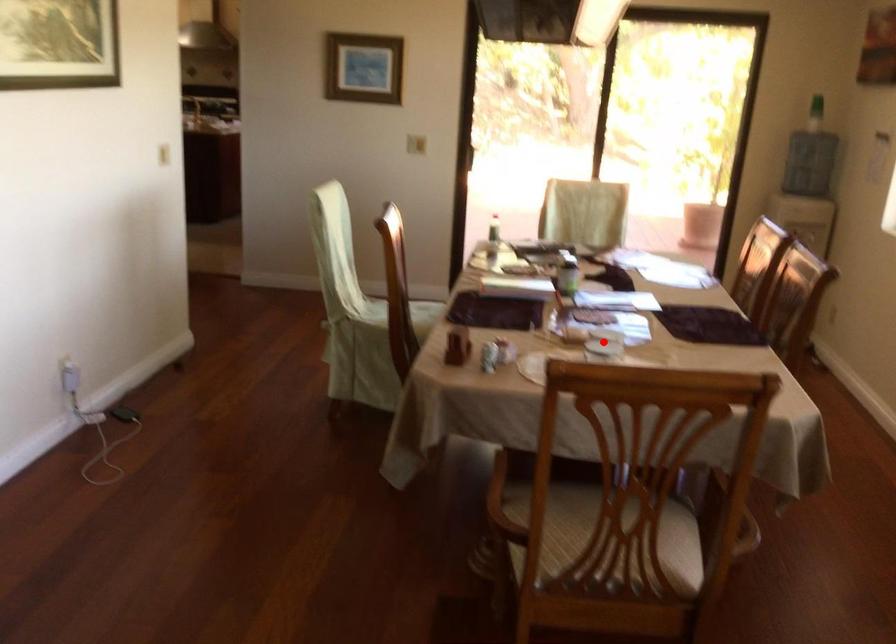
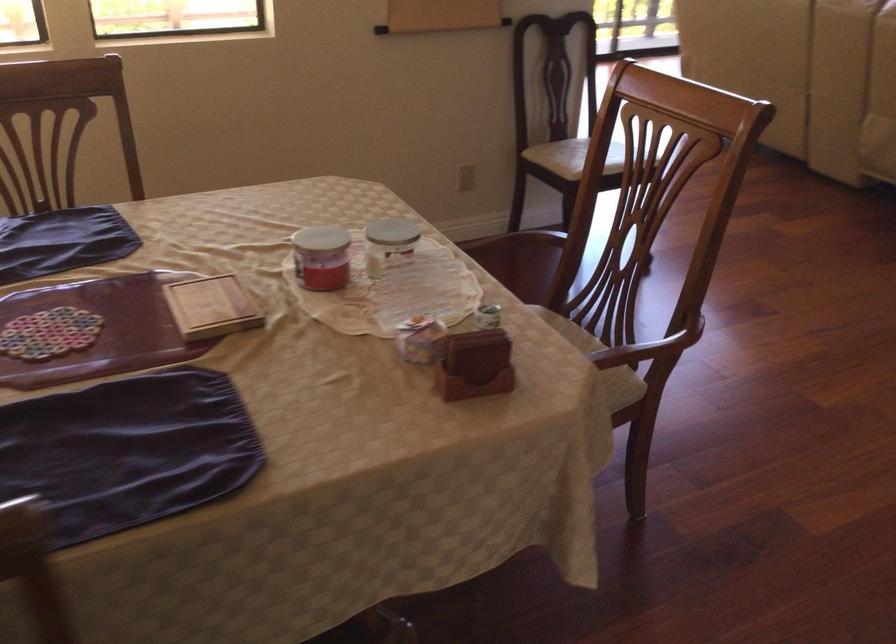
Locate, in the second image, the point that corresponds to the highlighted location in the first image.

(321, 257)